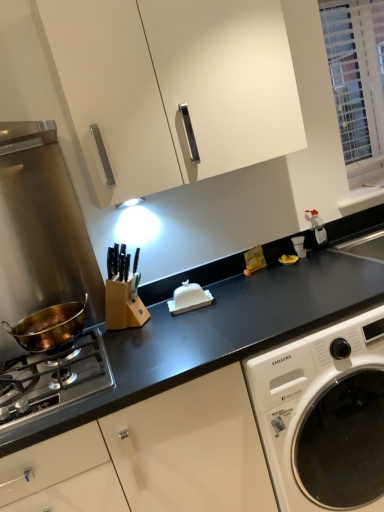
Question: Does bronze metallic wok at left have a larger size compared to white glossy washing machine at lower right?

Choices:
 (A) yes
 (B) no

Answer: (B)

Question: Considering the relative positions of bronze metallic wok at left and white glossy washing machine at lower right in the image provided, is bronze metallic wok at left to the left of white glossy washing machine at lower right from the viewer's perspective?

Choices:
 (A) no
 (B) yes

Answer: (B)

Question: Can you confirm if bronze metallic wok at left is wider than white glossy washing machine at lower right?

Choices:
 (A) no
 (B) yes

Answer: (A)

Question: From a real-world perspective, does bronze metallic wok at left stand above white glossy washing machine at lower right?

Choices:
 (A) yes
 (B) no

Answer: (A)

Question: Is the surface of bronze metallic wok at left in direct contact with white glossy washing machine at lower right?

Choices:
 (A) no
 (B) yes

Answer: (A)

Question: Does bronze metallic wok at left have a smaller size compared to white glossy washing machine at lower right?

Choices:
 (A) no
 (B) yes

Answer: (B)

Question: From a real-world perspective, is white glossy washing machine at lower right located higher than white matte cabinet at upper center?

Choices:
 (A) yes
 (B) no

Answer: (B)

Question: From the image's perspective, does white glossy washing machine at lower right appear lower than white matte cabinet at upper center?

Choices:
 (A) yes
 (B) no

Answer: (A)

Question: From a real-world perspective, is white glossy washing machine at lower right located beneath white matte cabinet at upper center?

Choices:
 (A) no
 (B) yes

Answer: (B)

Question: From the image's perspective, is white glossy washing machine at lower right on top of white matte cabinet at upper center?

Choices:
 (A) no
 (B) yes

Answer: (A)

Question: Is white glossy washing machine at lower right oriented away from white matte cabinet at upper center?

Choices:
 (A) no
 (B) yes

Answer: (A)

Question: Can you confirm if white glossy washing machine at lower right is bigger than white matte cabinet at upper center?

Choices:
 (A) yes
 (B) no

Answer: (A)

Question: Does bronze metallic wok at left have a lesser height compared to white glossy butter dish at center?

Choices:
 (A) yes
 (B) no

Answer: (B)